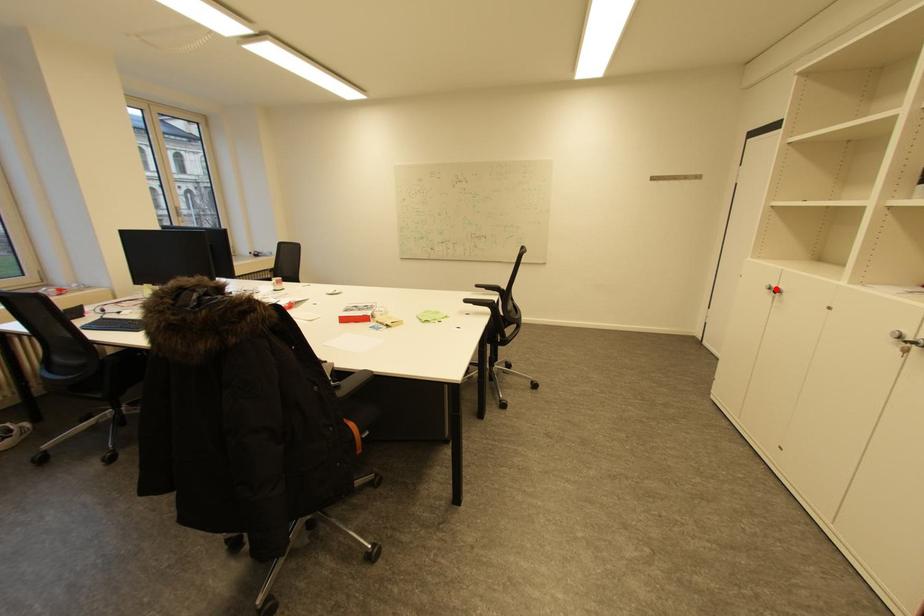
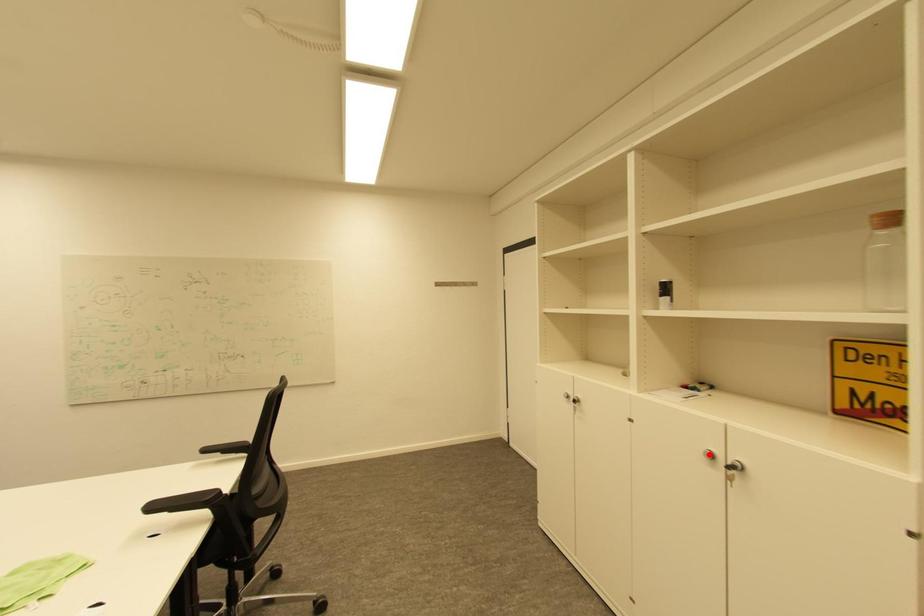
I am providing you with two images of the same scene from different viewpoints. A red point is marked on the first image and another point is marked on the second image. Are the points marked in image1 and image2 representing the same 3D position?

No